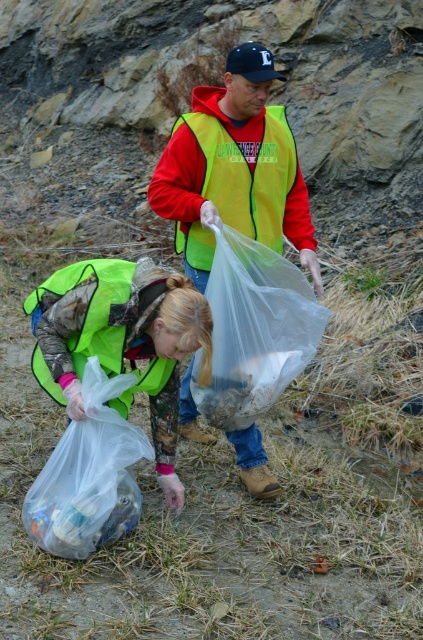
Between matte green vest at lower left and transparent plastic bag at center, which one appears on the right side from the viewer's perspective?

Positioned to the right is transparent plastic bag at center.

Does matte green vest at lower left appear on the right side of transparent plastic bag at center?

Incorrect, matte green vest at lower left is not on the right side of transparent plastic bag at center.

Which is behind, point (117, 264) or point (313, 339)?

The point (313, 339) is behind.

The width and height of the screenshot is (423, 640). Find the location of `matte green vest at lower left`. matte green vest at lower left is located at coordinates (121, 340).

Which is above, transparent plastic bag at center or translucent plastic bag at lower left?

transparent plastic bag at center is above.

Who is positioned more to the left, transparent plastic bag at center or translucent plastic bag at lower left?

translucent plastic bag at lower left is more to the left.

This screenshot has height=640, width=423. What do you see at coordinates (253, 330) in the screenshot? I see `transparent plastic bag at center` at bounding box center [253, 330].

Locate an element on the screen. Image resolution: width=423 pixels, height=640 pixels. transparent plastic bag at center is located at coordinates (253, 330).

Which is behind, point (191, 116) or point (164, 189)?

The point (191, 116) is behind.

Is matte yellow vest at center thinner than matte red jacket at center?

In fact, matte yellow vest at center might be wider than matte red jacket at center.

Between point (249, 74) and point (213, 109), which one is positioned behind?

Positioned behind is point (213, 109).

Identify the location of matte yellow vest at center. (233, 168).